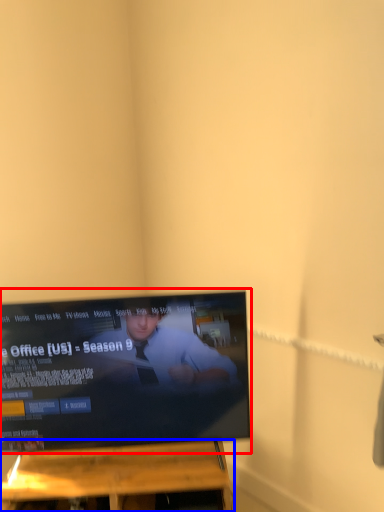
Question: Among these objects, which one is farthest to the camera, television (highlighted by a red box) or furniture (highlighted by a blue box)?

Choices:
 (A) television
 (B) furniture

Answer: (B)